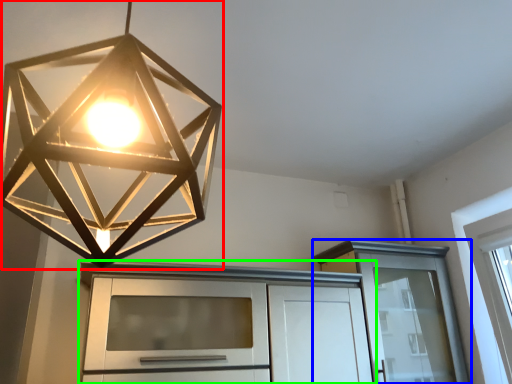
Question: Which is nearer to the lamp (highlighted by a red box)? cabinetry (highlighted by a blue box) or cabinetry (highlighted by a green box).

Choices:
 (A) cabinetry
 (B) cabinetry

Answer: (B)